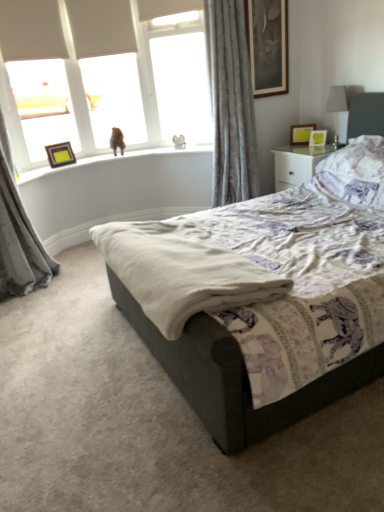
Question: Is matte white frame at upper left outside of gray velvet curtain at upper right, which ranks as the second curtain in left-to-right order?

Choices:
 (A) no
 (B) yes

Answer: (B)

Question: Is matte white frame at upper left taller than gray velvet curtain at upper right, arranged as the 1th curtain when viewed from the right?

Choices:
 (A) yes
 (B) no

Answer: (B)

Question: Does matte white frame at upper left have a smaller size compared to gray velvet curtain at upper right, arranged as the 1th curtain when viewed from the right?

Choices:
 (A) no
 (B) yes

Answer: (B)

Question: Is matte white frame at upper left not near gray velvet curtain at upper right, arranged as the 1th curtain when viewed from the right?

Choices:
 (A) no
 (B) yes

Answer: (B)

Question: Is matte white frame at upper left shorter than gray velvet curtain at upper right, arranged as the 1th curtain when viewed from the right?

Choices:
 (A) no
 (B) yes

Answer: (B)

Question: Is beige cotton blanket at center in front of or behind matte black picture frame at upper left, which is the 1th picture frame from bottom to top, in the image?

Choices:
 (A) behind
 (B) front

Answer: (B)

Question: In the image, is beige cotton blanket at center on the left side or the right side of matte black picture frame at upper left, the first picture frame in the left-to-right sequence?

Choices:
 (A) left
 (B) right

Answer: (B)

Question: From the image's perspective, relative to matte black picture frame at upper left, the 4th picture frame in the right-to-left sequence, is beige cotton blanket at center above or below?

Choices:
 (A) above
 (B) below

Answer: (B)

Question: Based on their sizes in the image, would you say beige cotton blanket at center is bigger or smaller than matte black picture frame at upper left, placed as the 4th picture frame when sorted from top to bottom?

Choices:
 (A) big
 (B) small

Answer: (A)

Question: From a real-world perspective, is purple floral pillow at upper right physically located above or below gray velvet curtain at upper right, which ranks as the second curtain in left-to-right order?

Choices:
 (A) below
 (B) above

Answer: (A)

Question: Is purple floral pillow at upper right in front of or behind gray velvet curtain at upper right, arranged as the 1th curtain when viewed from the right, in the image?

Choices:
 (A) behind
 (B) front

Answer: (B)

Question: Is purple floral pillow at upper right to the left or to the right of gray velvet curtain at upper right, arranged as the 1th curtain when viewed from the right, in the image?

Choices:
 (A) left
 (B) right

Answer: (B)

Question: Based on their sizes in the image, would you say purple floral pillow at upper right is bigger or smaller than gray velvet curtain at upper right, which ranks as the second curtain in left-to-right order?

Choices:
 (A) small
 (B) big

Answer: (A)

Question: Based on their positions, is matte white frame at upper left located to the left or right of velvet grey bed at center?

Choices:
 (A) left
 (B) right

Answer: (A)

Question: Does point (14, 66) appear closer or farther from the camera than point (369, 103)?

Choices:
 (A) closer
 (B) farther

Answer: (B)